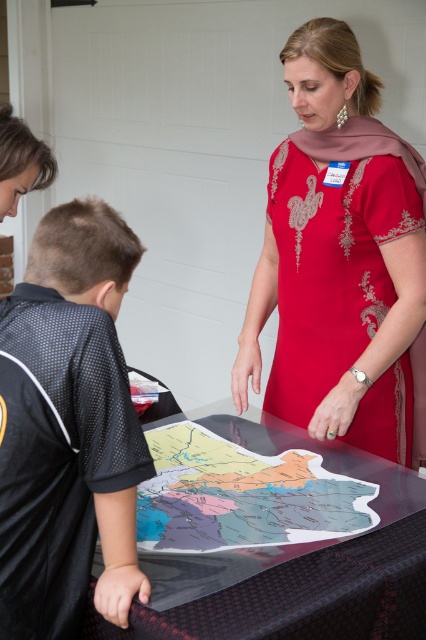
Question: Observing the image, what is the correct spatial positioning of black mesh shirt at lower left in reference to transparent plastic map at center?

Choices:
 (A) right
 (B) left

Answer: (B)

Question: Based on their relative distances, which object is farther from the black mesh shirt at lower left?

Choices:
 (A) red embroidered dress at center
 (B) paper map at center

Answer: (A)

Question: Estimate the real-world distances between objects in this image. Which object is farther from the transparent plastic map at center?

Choices:
 (A) paper map at center
 (B) black mesh shirt at lower left
 (C) red embroidered dress at center

Answer: (C)

Question: Does black mesh shirt at lower left have a larger size compared to red embroidered dress at center?

Choices:
 (A) yes
 (B) no

Answer: (B)

Question: Does transparent plastic map at center appear over paper map at center?

Choices:
 (A) no
 (B) yes

Answer: (A)

Question: Which is farther from the black mesh shirt at lower left?

Choices:
 (A) paper map at center
 (B) transparent plastic map at center
 (C) red embroidered dress at center

Answer: (C)